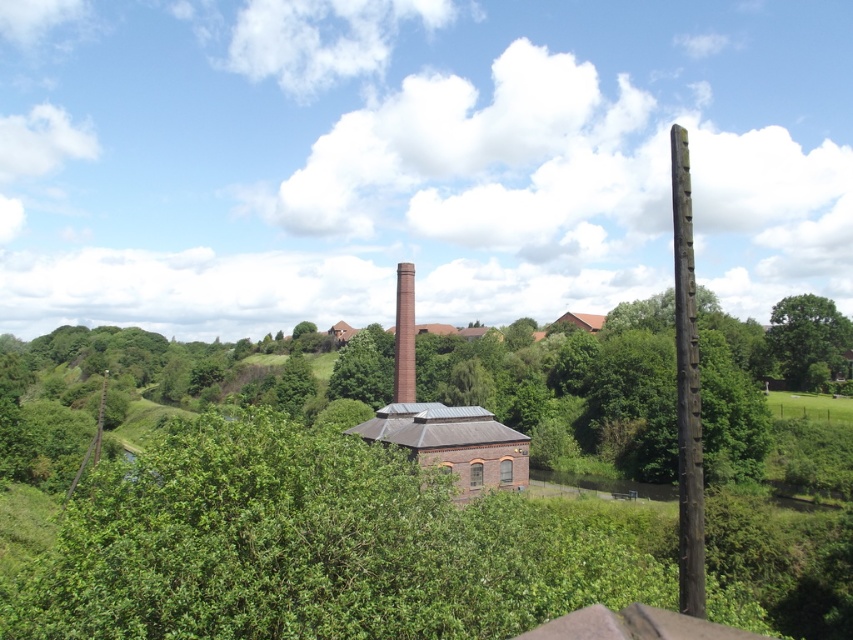
Question: Which point is closer to the camera taking this photo?

Choices:
 (A) (370, 353)
 (B) (401, 280)

Answer: (B)

Question: Is green leafy tree at right smaller than green leafy tree at center?

Choices:
 (A) yes
 (B) no

Answer: (A)

Question: Does green leafy tree at right appear on the left side of red brick chimney at center?

Choices:
 (A) no
 (B) yes

Answer: (A)

Question: Does brown wooden pole at right have a greater width compared to green leafy tree at center?

Choices:
 (A) yes
 (B) no

Answer: (A)

Question: Which object is the farthest from the brown wooden pole at right?

Choices:
 (A) green leafy tree at center
 (B) green leafy tree at right

Answer: (A)

Question: Which point appears farthest from the camera in this image?

Choices:
 (A) (676, 256)
 (B) (352, 346)
 (C) (793, 330)

Answer: (B)